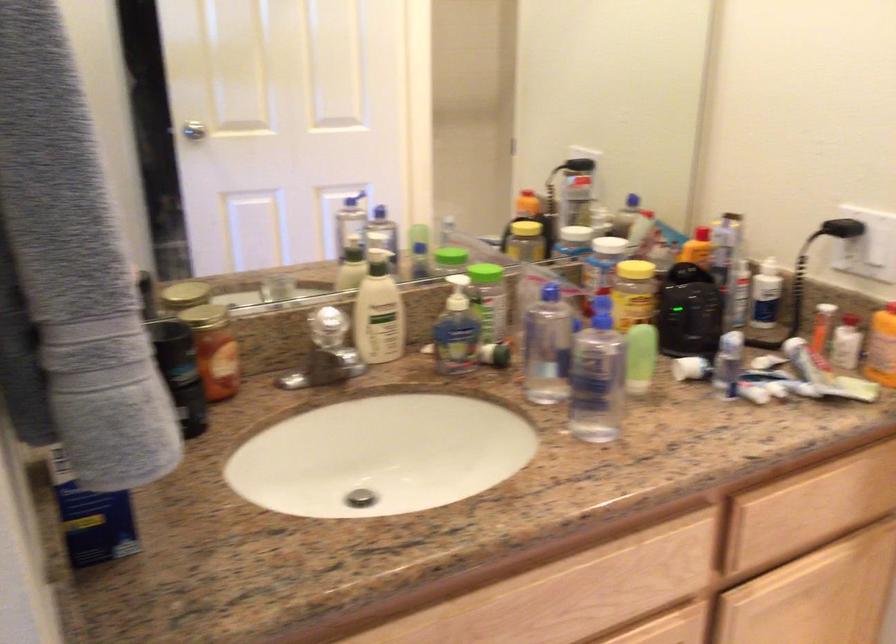
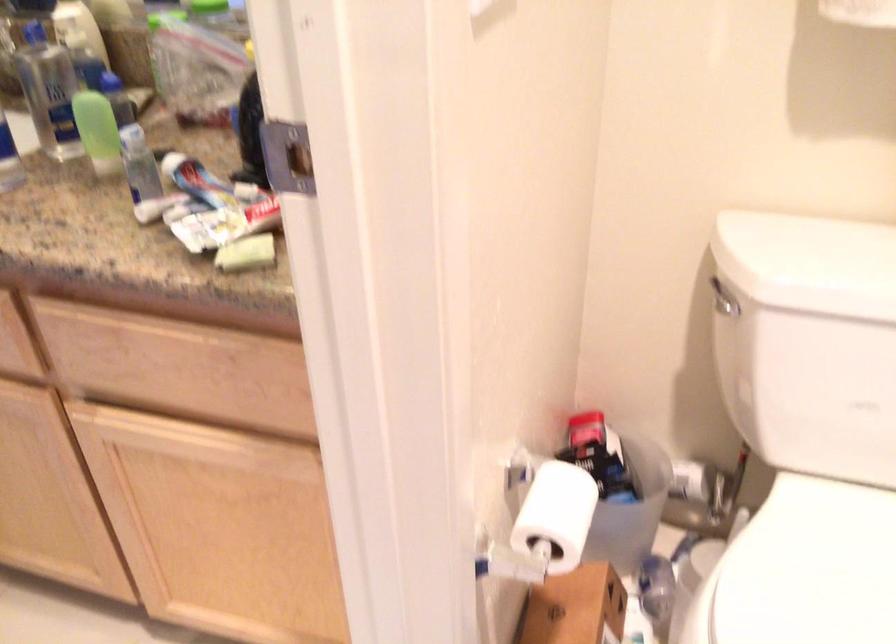
Find the pixel in the second image that matches pixel 821 507 in the first image.

(177, 368)